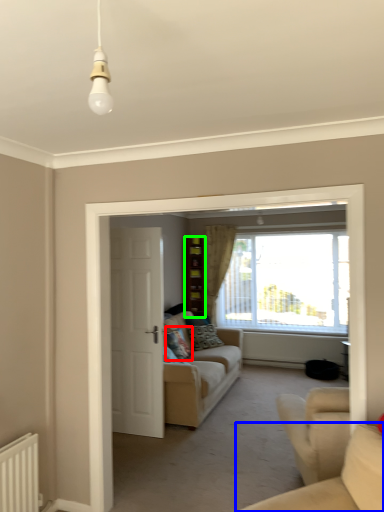
Question: Based on their relative distances, which object is nearer to pillow (highlighted by a red box)? Choose from studio couch (highlighted by a blue box) and cabinetry (highlighted by a green box).

Choices:
 (A) studio couch
 (B) cabinetry

Answer: (B)